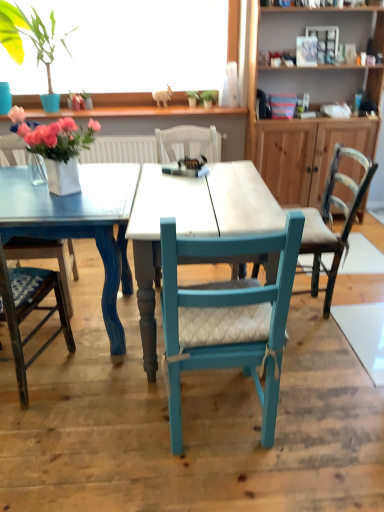
Question: Considering the positions of white wood table at center and blue fabric cushioned chair at left, arranged as the 2th chair when viewed from the left, in the image, is white wood table at center wider or thinner than blue fabric cushioned chair at left, arranged as the 2th chair when viewed from the left,?

Choices:
 (A) wide
 (B) thin

Answer: (A)

Question: From a real-world perspective, is white wood table at center physically located above or below blue fabric cushioned chair at left, arranged as the 2th chair when viewed from the left?

Choices:
 (A) above
 (B) below

Answer: (B)

Question: Which object is positioned farthest from the teal painted wood chair at center, acting as the 2th chair starting from the right?

Choices:
 (A) blue fabric cushioned chair at left, arranged as the 2th chair when viewed from the left
 (B) teal fabric chair at center, the 1th chair positioned from the right
 (C) wooden cabinet at upper right
 (D) matte pink flowers at left
 (E) matte blue chair at left, placed as the fourth chair when sorted from right to left

Answer: (C)

Question: Which object is the farthest from the wooden cabinet at upper right?

Choices:
 (A) matte blue chair at left, the 1th chair when ordered from left to right
 (B) green leafy plant at upper left
 (C) blue fabric cushioned chair at left, arranged as the 2th chair when viewed from the left
 (D) matte pink flowers at left
 (E) white wood table at center

Answer: (A)